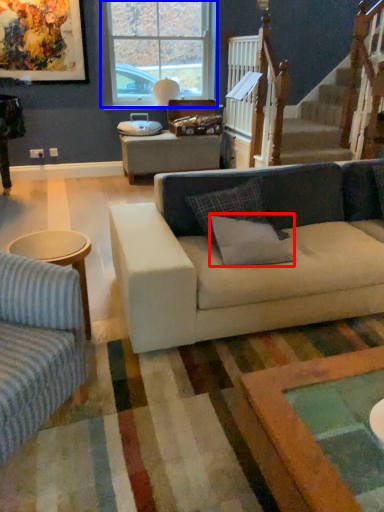
Question: Which of the following is the farthest to the observer, pillow (highlighted by a red box) or window (highlighted by a blue box)?

Choices:
 (A) pillow
 (B) window

Answer: (B)